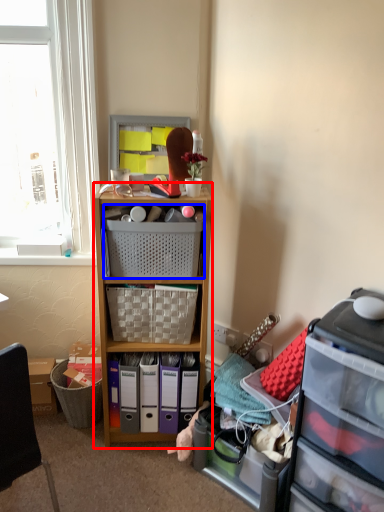
Question: Which object is further to the camera taking this photo, cabinetry (highlighted by a red box) or picnic basket (highlighted by a blue box)?

Choices:
 (A) cabinetry
 (B) picnic basket

Answer: (B)